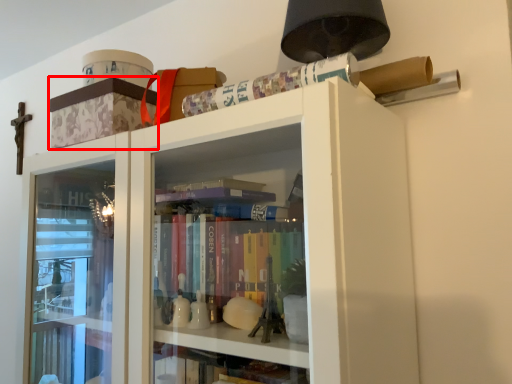
Question: Where is cabinetry (annotated by the red box) located in relation to paperback book in the image?

Choices:
 (A) right
 (B) left

Answer: (B)